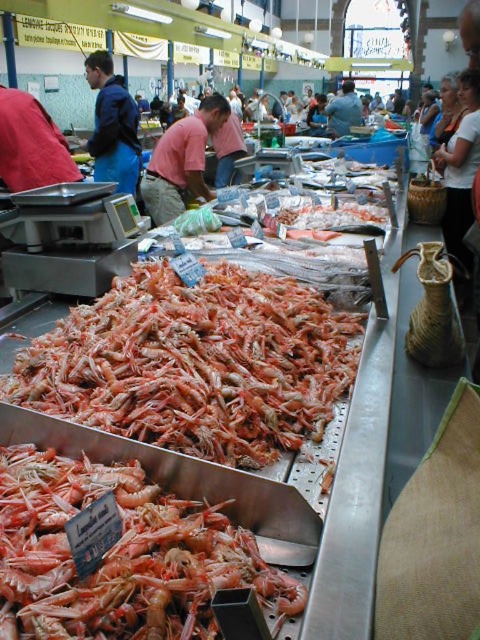
Looking at this image, which is more to the right, matte red shirt at left or blue fabric jacket at upper left?

matte red shirt at left is more to the right.

Is point (17, 157) farther from viewer compared to point (111, 88)?

That is False.

Locate an element on the screen. Image resolution: width=480 pixels, height=640 pixels. matte red shirt at left is located at coordinates (31, 145).

Can you confirm if shiny orange shrimp at center is taller than matte red shirt at left?

Incorrect, shiny orange shrimp at center's height is not larger of matte red shirt at left's.

This screenshot has height=640, width=480. I want to click on shiny orange shrimp at center, so click(x=120, y=556).

Does shiny orange shrimp at center appear on the left side of matte blue shirt at center?

Correct, you'll find shiny orange shrimp at center to the left of matte blue shirt at center.

From the picture: Is the position of shiny orange shrimp at center less distant than that of matte blue shirt at center?

Yes, it is in front of matte blue shirt at center.

Does point (72, 509) come farther from viewer compared to point (347, 83)?

That is False.

This screenshot has width=480, height=640. In order to click on shiny orange shrimp at center in this screenshot , I will do `click(120, 556)`.